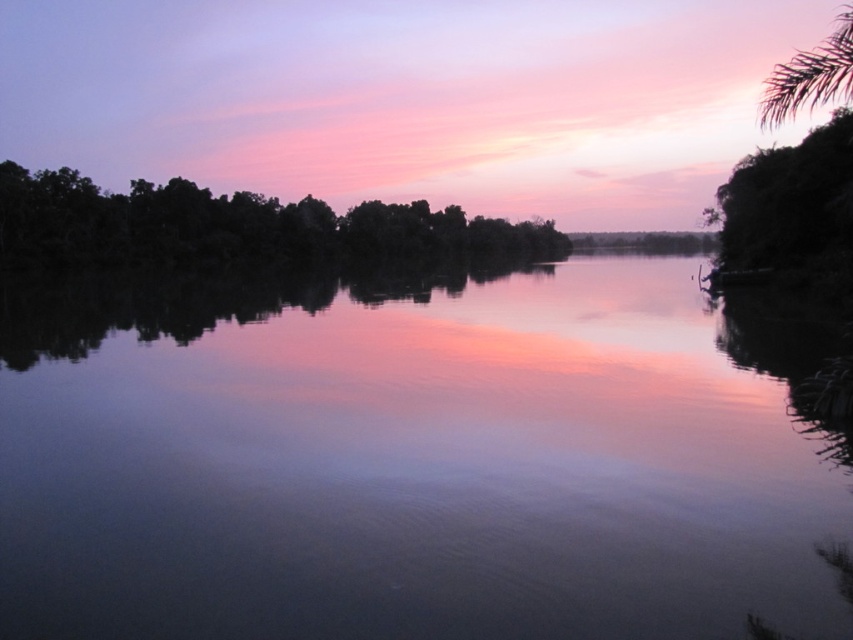
You are standing at the edge of the water and want to place a small floating lantern. The lantern requires a spot on the smooth water at center that is closest to the palm tree on the right. Where should you place it?

The smooth water at center is located at point (x=405, y=461), so you should place the lantern there as it is the closest point to the palm tree on the right.

You are an observer looking at the sunset scene. You notice the dark green leafy trees at left and the green leafy tree at upper right. Which of these two trees is positioned lower in the image?

The dark green leafy trees at left is positioned below the green leafy tree at upper right, so it is lower in the image.